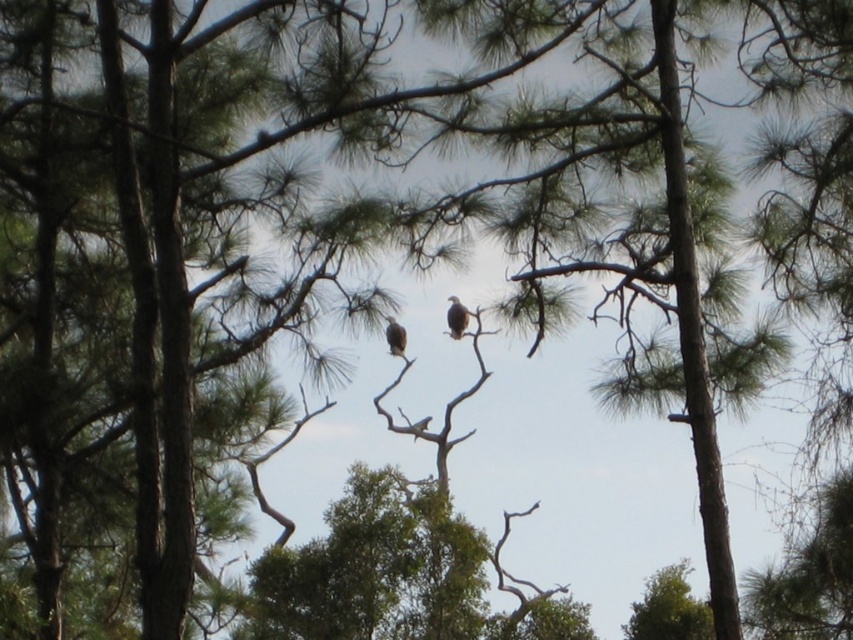
You are an ornithologist studying bird behavior in this pine forest. You observe a brown feathered bird at center. Based on its 2D coordinates, can you determine its exact position relative to the pine tree branches?

The brown feathered bird at center is located at the 2D coordinates point (457,317), which places it precisely at the center of the pine tree branches.

You are observing two birds on a pine tree in the center of the image. The birds are labeled as a brown feathered bird at center and a brown feathered eagle at center. Which of these two birds is taller?

The brown feathered bird at center is taller than the brown feathered eagle at center.